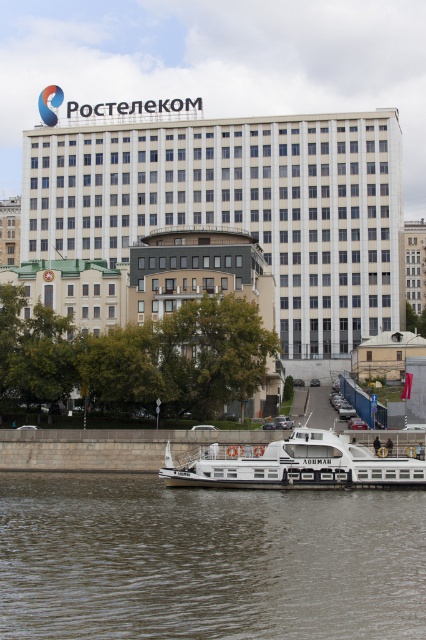
Question: Is brown water at lower center positioned before white glossy boat at lower center?

Choices:
 (A) yes
 (B) no

Answer: (A)

Question: Can you confirm if white glass building at upper center is positioned above white glossy boat at lower center?

Choices:
 (A) no
 (B) yes

Answer: (B)

Question: Is the position of brown water at lower center more distant than that of white concrete building at center?

Choices:
 (A) no
 (B) yes

Answer: (A)

Question: Which of these objects is positioned farthest from the white concrete building at center?

Choices:
 (A) brown water at lower center
 (B) white glossy boat at lower center
 (C) white glass building at upper center

Answer: (A)

Question: Which of the following is the closest to the observer?

Choices:
 (A) (144, 168)
 (B) (16, 524)
 (C) (367, 472)

Answer: (B)

Question: Which is farther from the white glass building at upper center?

Choices:
 (A) brown water at lower center
 (B) white glossy boat at lower center
 (C) white concrete building at center

Answer: (A)